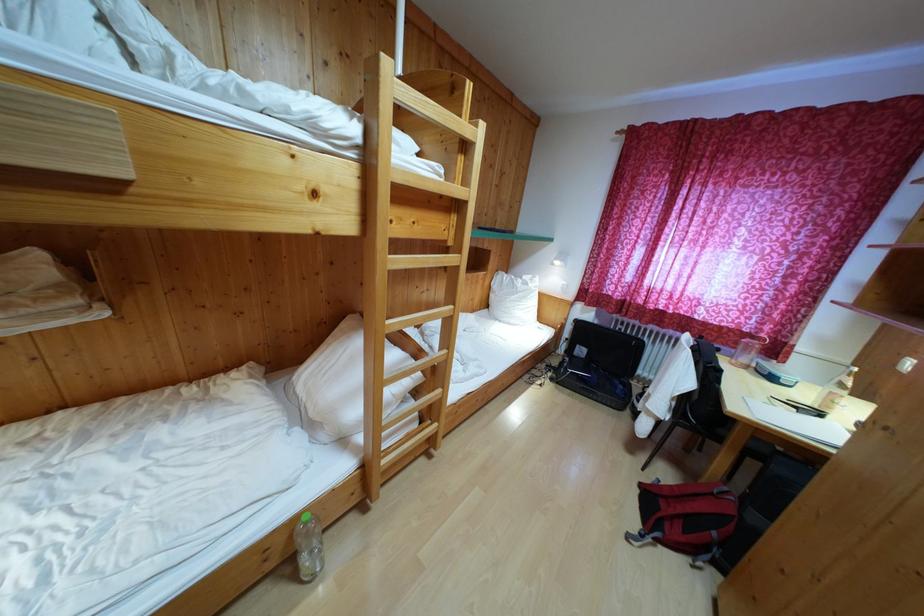
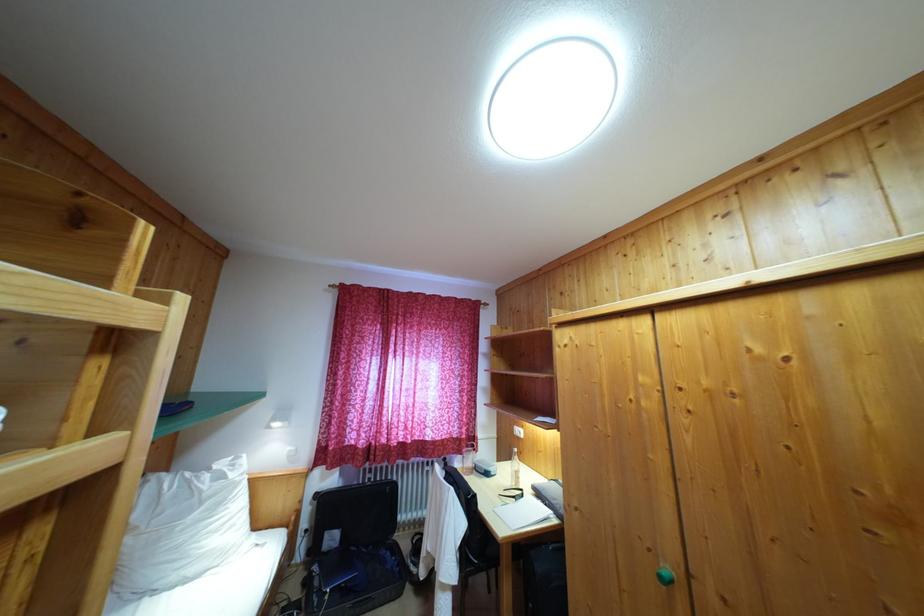
The point at (525, 285) is marked in the first image. Where is the corresponding point in the second image?

(213, 476)